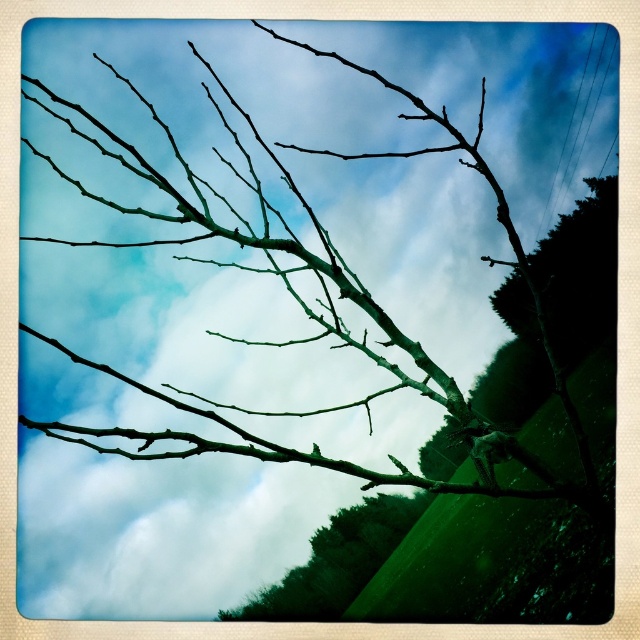
Question: Can you confirm if green matte tree branch at right is thinner than green matte tree branch at lower center?

Choices:
 (A) yes
 (B) no

Answer: (B)

Question: Which point is closer to the camera taking this photo?

Choices:
 (A) (358, 580)
 (B) (540, 273)

Answer: (A)

Question: Does green matte tree branch at right lie behind green matte tree branch at lower center?

Choices:
 (A) no
 (B) yes

Answer: (B)

Question: Which of the following is the closest to the observer?

Choices:
 (A) green matte tree branch at right
 (B) green matte tree branch at lower center

Answer: (B)

Question: Does green matte tree branch at right appear on the left side of green matte tree branch at lower center?

Choices:
 (A) yes
 (B) no

Answer: (B)